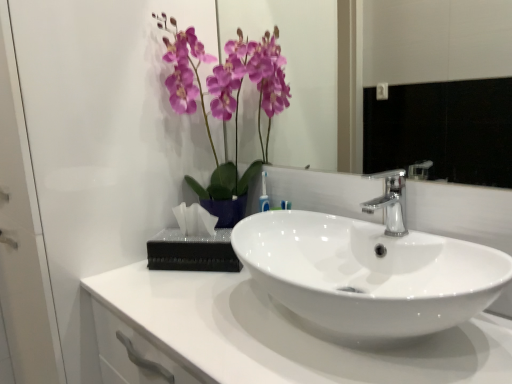
Question: Considering the relative sizes of white glossy countertop at center and satin nickel faucet at center in the image provided, is white glossy countertop at center taller than satin nickel faucet at center?

Choices:
 (A) yes
 (B) no

Answer: (A)

Question: Does white glossy countertop at center have a lesser height compared to satin nickel faucet at center?

Choices:
 (A) yes
 (B) no

Answer: (B)

Question: Could satin nickel faucet at center be considered to be inside white glossy countertop at center?

Choices:
 (A) yes
 (B) no

Answer: (B)

Question: Considering the relative sizes of white glossy countertop at center and satin nickel faucet at center in the image provided, is white glossy countertop at center thinner than satin nickel faucet at center?

Choices:
 (A) yes
 (B) no

Answer: (B)

Question: From the image's perspective, does white glossy countertop at center appear higher than satin nickel faucet at center?

Choices:
 (A) no
 (B) yes

Answer: (A)

Question: From their relative heights in the image, would you say satin nickel faucet at center is taller or shorter than purple glossy orchid at upper center?

Choices:
 (A) tall
 (B) short

Answer: (B)

Question: Is point (388, 170) positioned closer to the camera than point (224, 66)?

Choices:
 (A) farther
 (B) closer

Answer: (B)

Question: From a real-world perspective, relative to purple glossy orchid at upper center, is satin nickel faucet at center vertically above or below?

Choices:
 (A) below
 (B) above

Answer: (A)

Question: Looking at their shapes, would you say satin nickel faucet at center is wider or thinner than purple glossy orchid at upper center?

Choices:
 (A) thin
 (B) wide

Answer: (A)

Question: From a real-world perspective, is satin nickel faucet at center physically located above or below white glossy countertop at center?

Choices:
 (A) below
 (B) above

Answer: (B)

Question: Is point (386, 172) closer or farther from the camera than point (208, 340)?

Choices:
 (A) farther
 (B) closer

Answer: (A)

Question: Considering the positions of satin nickel faucet at center and white glossy countertop at center in the image, is satin nickel faucet at center wider or thinner than white glossy countertop at center?

Choices:
 (A) wide
 (B) thin

Answer: (B)

Question: Is satin nickel faucet at center taller or shorter than white glossy countertop at center?

Choices:
 (A) tall
 (B) short

Answer: (B)

Question: Is glossy ceramic mirror at upper center bigger or smaller than white glossy countertop at center?

Choices:
 (A) big
 (B) small

Answer: (B)

Question: From the image's perspective, relative to white glossy countertop at center, is glossy ceramic mirror at upper center above or below?

Choices:
 (A) below
 (B) above

Answer: (B)